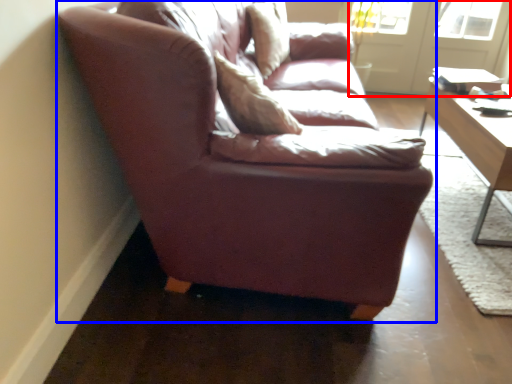
Question: Which object appears farthest to the camera in this image, screen door (highlighted by a red box) or studio couch (highlighted by a blue box)?

Choices:
 (A) screen door
 (B) studio couch

Answer: (A)